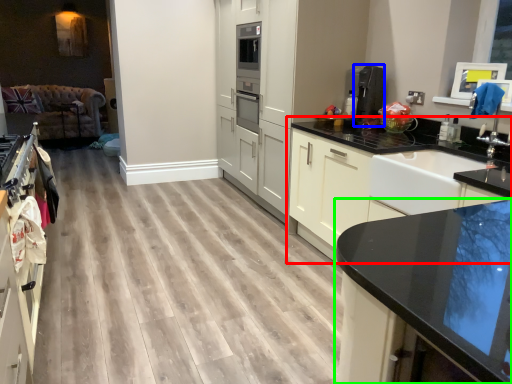
Question: Considering the real-world distances, which object is closest to cabinetry (highlighted by a red box)? coffee machine (highlighted by a blue box) or countertop (highlighted by a green box).

Choices:
 (A) coffee machine
 (B) countertop

Answer: (A)